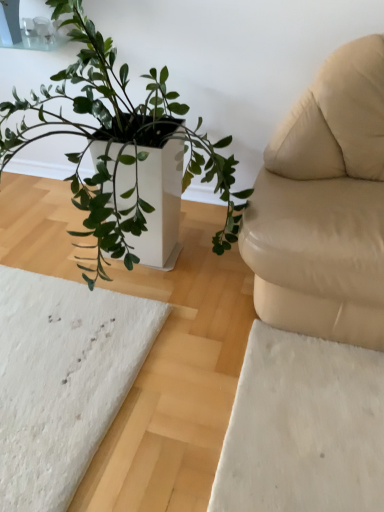
This screenshot has height=512, width=384. Describe the element at coordinates (119, 140) in the screenshot. I see `white matte planter at center` at that location.

Measure the distance between point (13, 105) and camera.

Point (13, 105) and camera are 1.62 meters apart from each other.

At what (x,y) coordinates should I click in order to perform the action: click on white matte planter at center. Please return your answer as a coordinate pair (x, y). Looking at the image, I should click on (119, 140).

Image resolution: width=384 pixels, height=512 pixels. Identify the location of white matte planter at center. (119, 140).